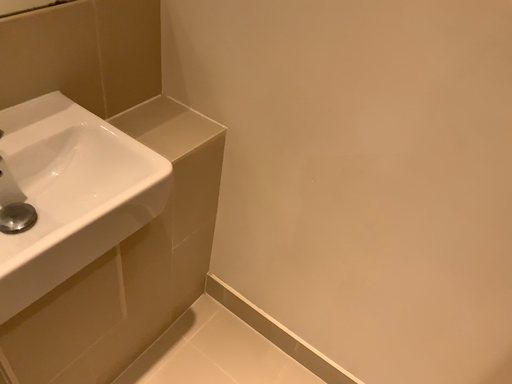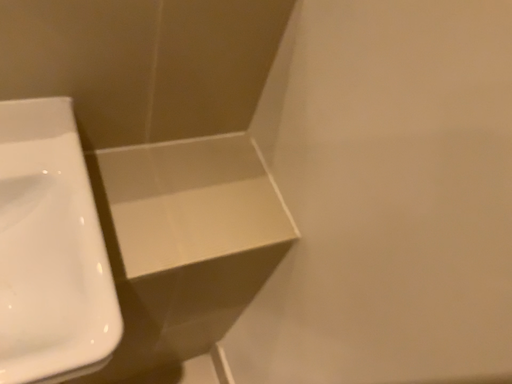
Question: How did the camera likely rotate when shooting the video?

Choices:
 (A) rotated left
 (B) rotated right

Answer: (A)